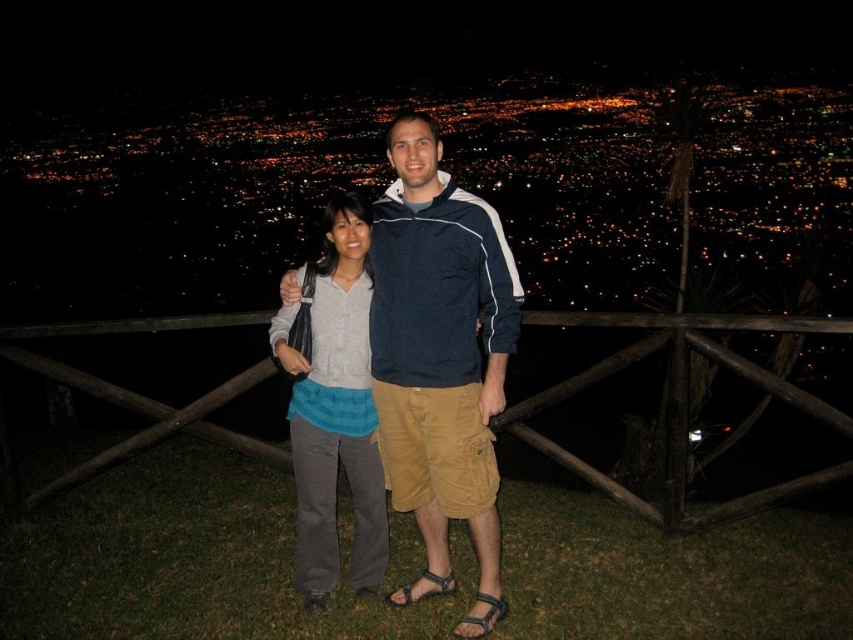
Question: Is matte gray pants at center smaller than black leather sandal at lower center?

Choices:
 (A) yes
 (B) no

Answer: (B)

Question: Where is wooden at center located in relation to matte gray pants at center in the image?

Choices:
 (A) left
 (B) right

Answer: (A)

Question: Among these objects, which one is farthest from the camera?

Choices:
 (A) black leather sandal at lower center
 (B) matte gray pants at center
 (C) blue cotton shirt at center
 (D) brown leather sandal at lower center

Answer: (D)

Question: Estimate the real-world distances between objects in this image. Which object is farther from the brown leather sandal at lower center?

Choices:
 (A) blue cotton shirt at center
 (B) black leather sandal at lower center
 (C) matte gray pants at center

Answer: (A)

Question: Is blue cotton shirt at center positioned at the back of black leather sandal at lower center?

Choices:
 (A) yes
 (B) no

Answer: (A)

Question: Which of the following is the farthest from the observer?

Choices:
 (A) (474, 604)
 (B) (434, 592)
 (C) (840, 321)
 (D) (283, 276)

Answer: (C)